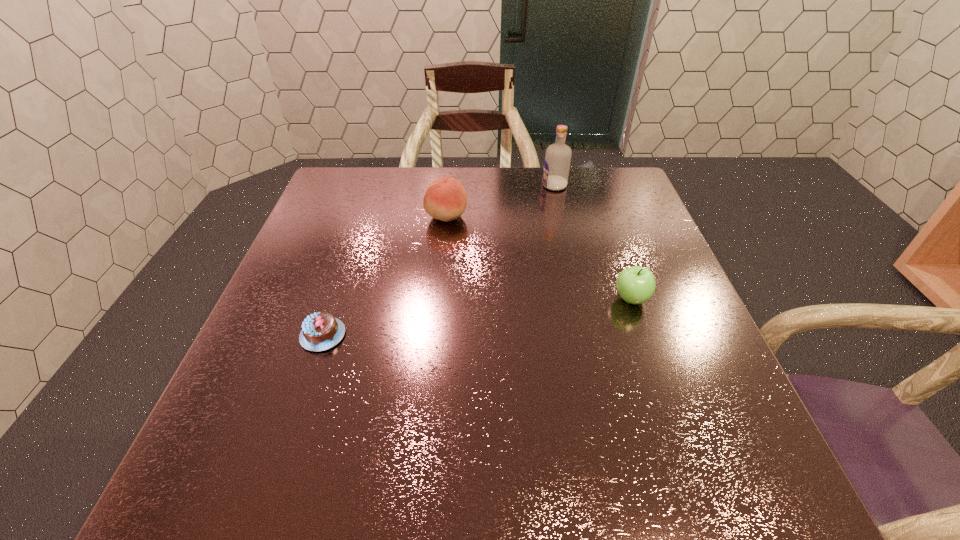
I want to click on the third object from left to right, so click(557, 160).

What are the coordinates of `the tallest object` in the screenshot? It's located at (557, 160).

Find the location of a particular element. the second tallest object is located at coordinates (445, 199).

I want to click on peach, so click(445, 199).

Find the location of a particular element. The image size is (960, 540). the rightmost object is located at coordinates coord(636,284).

Where is `the third tallest object`? The width and height of the screenshot is (960, 540). the third tallest object is located at coordinates (636, 284).

The width and height of the screenshot is (960, 540). Identify the location of the leftmost object. (320, 331).

Identify the location of the nearest object. This screenshot has width=960, height=540. (320, 331).

Where is `free space located on the label of the farthest object`? This screenshot has width=960, height=540. free space located on the label of the farthest object is located at coordinates (481, 186).

In order to click on free space located on the label of the farthest object in this screenshot , I will do `click(420, 186)`.